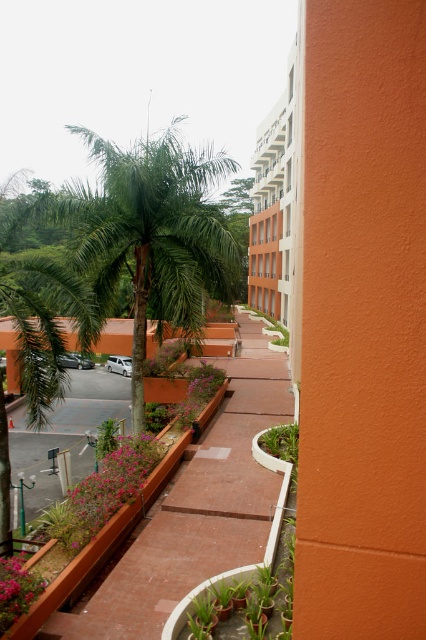
Who is taller, green leafy palm tree at center or white concrete building at upper center?

Standing taller between the two is white concrete building at upper center.

Based on the photo, does green leafy palm tree at center appear over white concrete building at upper center?

No.

Is point (201, 177) closer to viewer compared to point (299, 246)?

Yes, it is in front of point (299, 246).

What are the coordinates of `green leafy palm tree at center` in the screenshot? It's located at (152, 236).

Who is more forward, (244, 385) or (184, 204)?

Point (184, 204) is in front.

Consider the image. Can you confirm if brick pathway at center is positioned above green leafy palm tree at center?

No, brick pathway at center is not above green leafy palm tree at center.

Is point (233, 403) positioned in front of point (181, 209)?

No, it is not.

In order to click on brick pathway at center in this screenshot , I will do `click(198, 509)`.

Is white concrete building at upper center to the right of pink matte flowers at lower left from the viewer's perspective?

Indeed, white concrete building at upper center is positioned on the right side of pink matte flowers at lower left.

Is point (299, 284) closer to camera compared to point (2, 568)?

No, it is not.

Where is `white concrete building at upper center`? This screenshot has width=426, height=640. white concrete building at upper center is located at coordinates (279, 209).